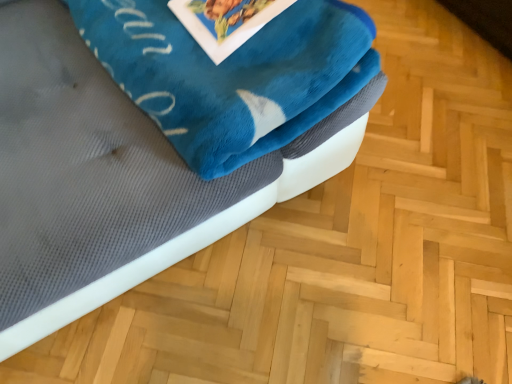
Where is `vacant area that lies to the right of velvety blue blanket at upper left`? vacant area that lies to the right of velvety blue blanket at upper left is located at coordinates (406, 185).